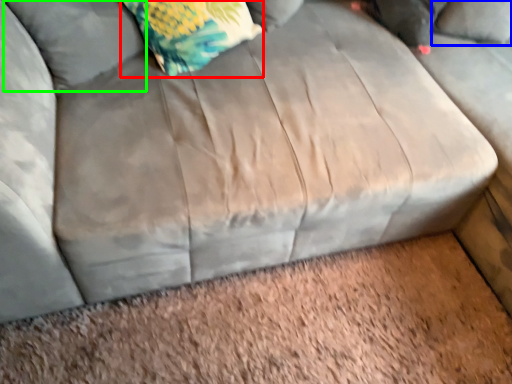
Question: Based on their relative distances, which object is farther from throw pillow (highlighted by a red box)? Choose from pillow (highlighted by a blue box) and pillow (highlighted by a green box).

Choices:
 (A) pillow
 (B) pillow

Answer: (A)